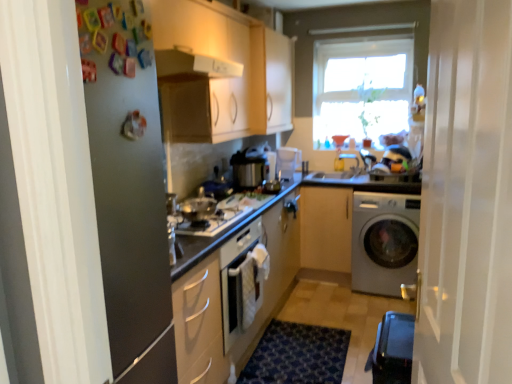
Question: From the image's perspective, does shiny silver gas stove at center appear higher than matte wood cabinet at upper center, which is the 2th cabinetry in right-to-left order?

Choices:
 (A) no
 (B) yes

Answer: (A)

Question: From a real-world perspective, is shiny silver gas stove at center on matte wood cabinet at upper center, which is the 2th cabinetry in right-to-left order?

Choices:
 (A) yes
 (B) no

Answer: (B)

Question: Would you say matte wood cabinet at upper center, the 2th cabinetry positioned from the left, is part of shiny silver gas stove at center's contents?

Choices:
 (A) no
 (B) yes

Answer: (A)

Question: Does shiny silver gas stove at center touch matte wood cabinet at upper center, the 2th cabinetry positioned from the left?

Choices:
 (A) no
 (B) yes

Answer: (A)

Question: Is shiny silver gas stove at center far from matte wood cabinet at upper center, the 2th cabinetry positioned from the left?

Choices:
 (A) no
 (B) yes

Answer: (B)

Question: From the image's perspective, is shiny silver gas stove at center under matte wood cabinet at upper center, the 2th cabinetry positioned from the left?

Choices:
 (A) no
 (B) yes

Answer: (B)

Question: From the image's perspective, would you say matte white cabinet at upper left, positioned as the 1th cabinetry in left-to-right order, is shown under shiny silver gas stove at center?

Choices:
 (A) yes
 (B) no

Answer: (B)

Question: Is matte white cabinet at upper left, positioned as the 1th cabinetry in left-to-right order, far from shiny silver gas stove at center?

Choices:
 (A) no
 (B) yes

Answer: (A)

Question: Does matte white cabinet at upper left, the 3th cabinetry from the right, have a lesser width compared to shiny silver gas stove at center?

Choices:
 (A) yes
 (B) no

Answer: (A)

Question: From a real-world perspective, is matte white cabinet at upper left, positioned as the 1th cabinetry in left-to-right order, positioned over shiny silver gas stove at center based on gravity?

Choices:
 (A) no
 (B) yes

Answer: (B)

Question: Can you confirm if matte white cabinet at upper left, positioned as the 1th cabinetry in left-to-right order, is smaller than shiny silver gas stove at center?

Choices:
 (A) no
 (B) yes

Answer: (A)

Question: From a real-world perspective, is matte white cabinet at upper left, the 3th cabinetry from the right, physically below shiny silver gas stove at center?

Choices:
 (A) no
 (B) yes

Answer: (A)

Question: Is matte wood cabinet at upper center, the 2th cabinetry positioned from the left, further to camera compared to transparent glass window at upper center?

Choices:
 (A) no
 (B) yes

Answer: (A)